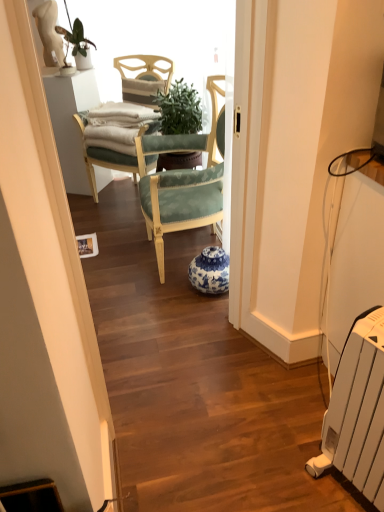
This screenshot has width=384, height=512. In order to click on green leafy plant at upper left in this screenshot , I will do `click(78, 44)`.

From the image's perspective, which is above, blue and white porcelain vase at center or white plastic radiator at lower right?

From the image's view, blue and white porcelain vase at center is above.

Is blue and white porcelain vase at center bigger than white plastic radiator at lower right?

Actually, blue and white porcelain vase at center might be smaller than white plastic radiator at lower right.

Relative to white plastic radiator at lower right, is blue and white porcelain vase at center in front or behind?

blue and white porcelain vase at center is positioned farther from the viewer than white plastic radiator at lower right.

Which of these two, blue and white porcelain vase at center or white plastic radiator at lower right, stands taller?

white plastic radiator at lower right.

From the image's perspective, which object appears higher, blue and white porcelain vase at center or green leafy plant at upper left?

green leafy plant at upper left appears higher in the image.

Which object is thinner, blue and white porcelain vase at center or green leafy plant at upper left?

green leafy plant at upper left is thinner.

Is blue and white porcelain vase at center positioned with its back to green leafy plant at upper left?

No.

Does white plastic radiator at lower right touch green leafy plant at upper left?

No, white plastic radiator at lower right is not next to green leafy plant at upper left.

Considering the sizes of objects white plastic radiator at lower right and green leafy plant at upper left in the image provided, who is wider, white plastic radiator at lower right or green leafy plant at upper left?

white plastic radiator at lower right is wider.

I want to click on houseplant that is behind the white plastic radiator at lower right, so click(x=78, y=44).

Is white plastic radiator at lower right in front of or behind blue and white porcelain vase at center in the image?

Clearly, white plastic radiator at lower right is in front of blue and white porcelain vase at center.

Who is bigger, white plastic radiator at lower right or blue and white porcelain vase at center?

Bigger between the two is white plastic radiator at lower right.

Does white plastic radiator at lower right have a greater width compared to blue and white porcelain vase at center?

Yes, white plastic radiator at lower right is wider than blue and white porcelain vase at center.

Is the surface of white plastic radiator at lower right in direct contact with blue and white porcelain vase at center?

No, white plastic radiator at lower right is not touching blue and white porcelain vase at center.

Is green leafy plant at upper left far away from blue and white porcelain vase at center?

green leafy plant at upper left is far away from blue and white porcelain vase at center.

This screenshot has width=384, height=512. I want to click on houseplant behind the blue and white porcelain vase at center, so click(x=78, y=44).

Considering the sizes of objects green leafy plant at upper left and blue and white porcelain vase at center in the image provided, who is shorter, green leafy plant at upper left or blue and white porcelain vase at center?

blue and white porcelain vase at center is shorter.

From the image's perspective, is green leafy plant at upper left located above or below blue and white porcelain vase at center?

Clearly, from the image's perspective, green leafy plant at upper left is above blue and white porcelain vase at center.

From the image's perspective, is green leafy plant at upper left under white plastic radiator at lower right?

Incorrect, from the image's perspective, green leafy plant at upper left is higher than white plastic radiator at lower right.

Is green leafy plant at upper left in front of or behind white plastic radiator at lower right in the image?

green leafy plant at upper left is positioned farther from the viewer than white plastic radiator at lower right.

From a real-world perspective, who is located higher, green leafy plant at upper left or white plastic radiator at lower right?

In real-world perspective, green leafy plant at upper left is above.

Is green leafy plant at upper left not close to white plastic radiator at lower right?

Absolutely, green leafy plant at upper left is distant from white plastic radiator at lower right.

Where is `radiator above the blue and white porcelain vase at center (from a real-world perspective)`? This screenshot has width=384, height=512. radiator above the blue and white porcelain vase at center (from a real-world perspective) is located at coordinates (355, 401).

Where is `houseplant located behind the blue and white porcelain vase at center`? Image resolution: width=384 pixels, height=512 pixels. houseplant located behind the blue and white porcelain vase at center is located at coordinates (78, 44).

Considering their positions, is white plastic radiator at lower right positioned further to green leafy plant at upper left than blue and white porcelain vase at center?

white plastic radiator at lower right lies further to green leafy plant at upper left than the other object.

Estimate the real-world distances between objects in this image. Which object is closer to white plastic radiator at lower right, green leafy plant at upper left or blue and white porcelain vase at center?

The object closer to white plastic radiator at lower right is blue and white porcelain vase at center.

Based on the photo, based on their spatial positions, is green leafy plant at upper left or white plastic radiator at lower right closer to blue and white porcelain vase at center?

Among the two, white plastic radiator at lower right is located nearer to blue and white porcelain vase at center.

Which object lies nearer to the anchor point green leafy plant at upper left, blue and white porcelain vase at center or white plastic radiator at lower right?

blue and white porcelain vase at center.

Which object lies further to the anchor point white plastic radiator at lower right, blue and white porcelain vase at center or green leafy plant at upper left?

Based on the image, green leafy plant at upper left appears to be further to white plastic radiator at lower right.

From the picture: From the image, which object appears to be farther from blue and white porcelain vase at center, white plastic radiator at lower right or green leafy plant at upper left?

green leafy plant at upper left is further to blue and white porcelain vase at center.

You are a GUI agent. You are given a task and a screenshot of the screen. Output one action in this format:
    pyautogui.click(x=<x>, y=<y>)
    Task: Click on the vase between green leafy plant at upper left and white plastic radiator at lower right in the up-down direction
    Image resolution: width=384 pixels, height=512 pixels.
    Given the screenshot: What is the action you would take?
    pyautogui.click(x=210, y=271)